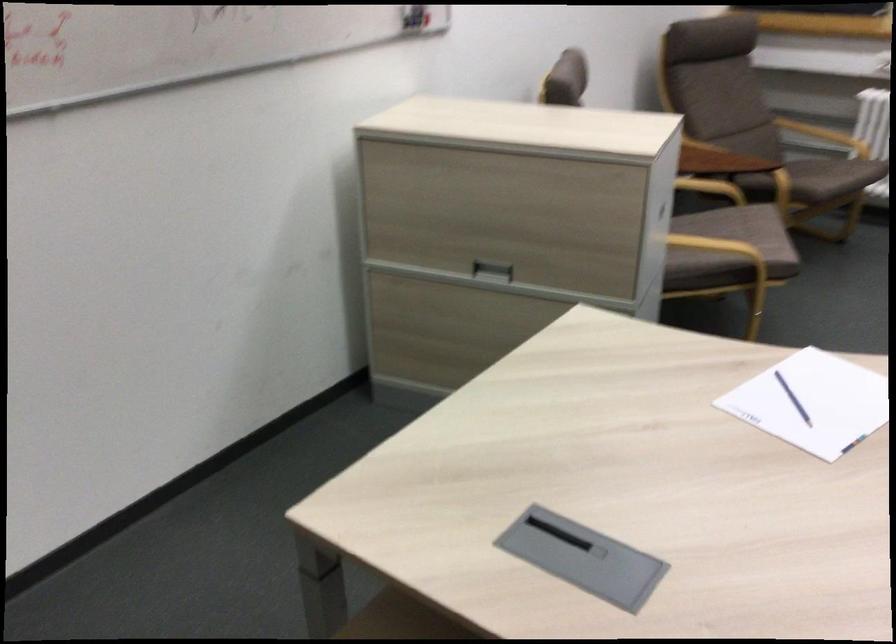
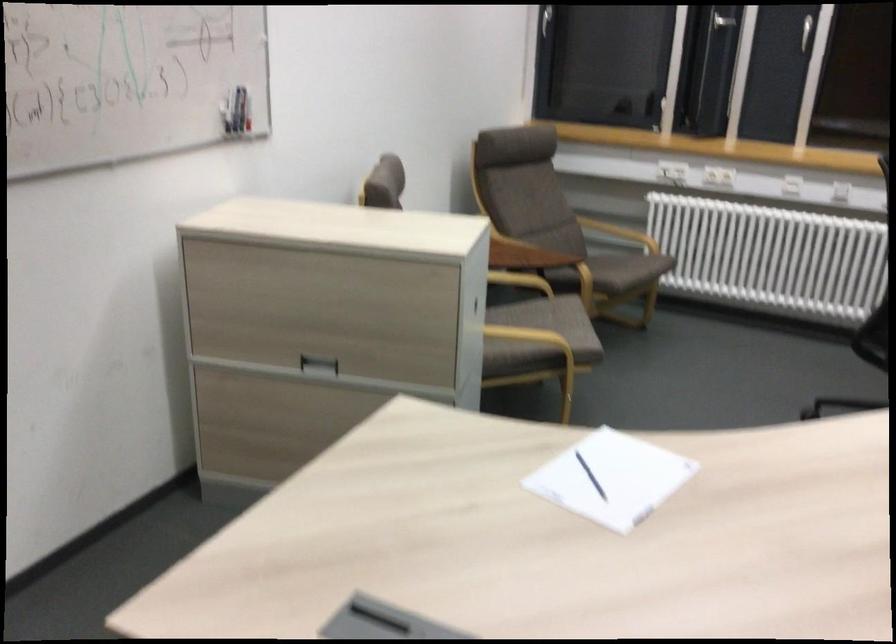
Locate, in the second image, the point that corresponds to pixel 707 185 in the first image.

(520, 279)